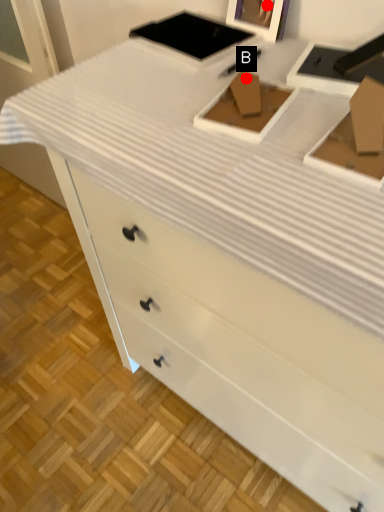
Question: Two points are circled on the image, labeled by A and B beside each circle. Which point is closer to the camera?

Choices:
 (A) A is closer
 (B) B is closer

Answer: (B)